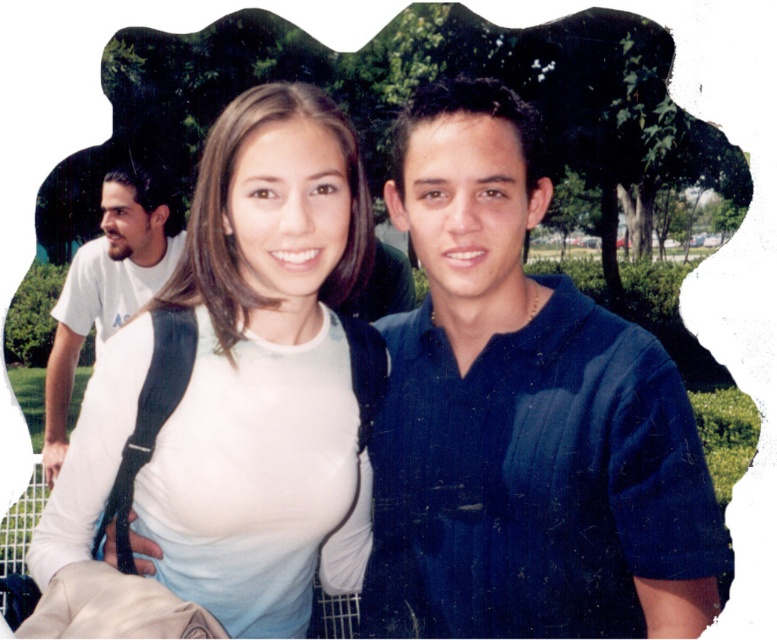
Question: Which point is closer to the camera?

Choices:
 (A) (138, 227)
 (B) (312, 470)
 (C) (446, 608)

Answer: (C)

Question: Which point is closer to the camera?

Choices:
 (A) (84, 444)
 (B) (51, 353)

Answer: (A)

Question: Does dark blue shirt at center come behind white matte shirt at center?

Choices:
 (A) no
 (B) yes

Answer: (B)

Question: Which object is positioned farthest from the white matte shirt at center?

Choices:
 (A) white t-shirt at left
 (B) dark blue shirt at center

Answer: (A)

Question: Does dark blue shirt at center appear on the right side of white matte shirt at center?

Choices:
 (A) no
 (B) yes

Answer: (B)

Question: In this image, where is dark blue shirt at center located relative to white matte shirt at center?

Choices:
 (A) right
 (B) left

Answer: (A)